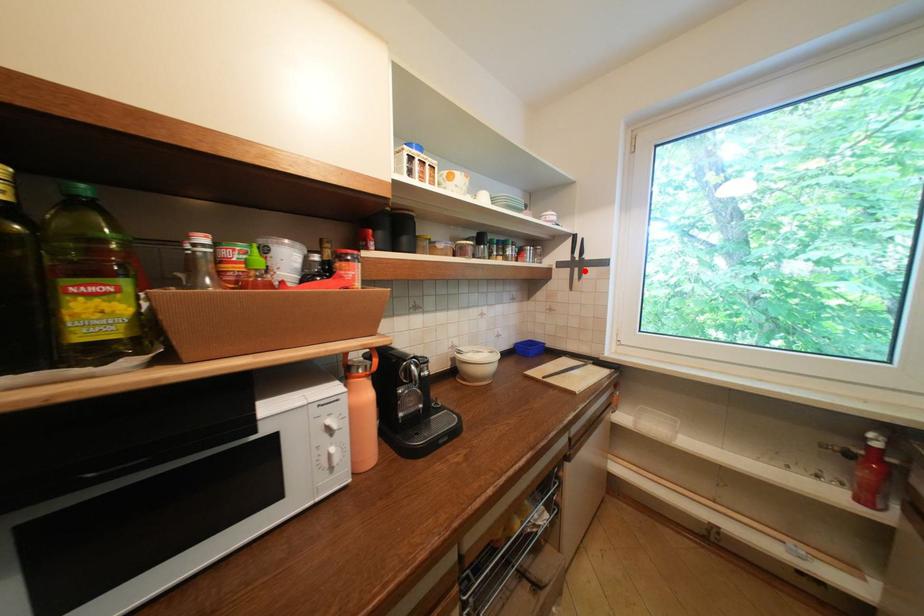
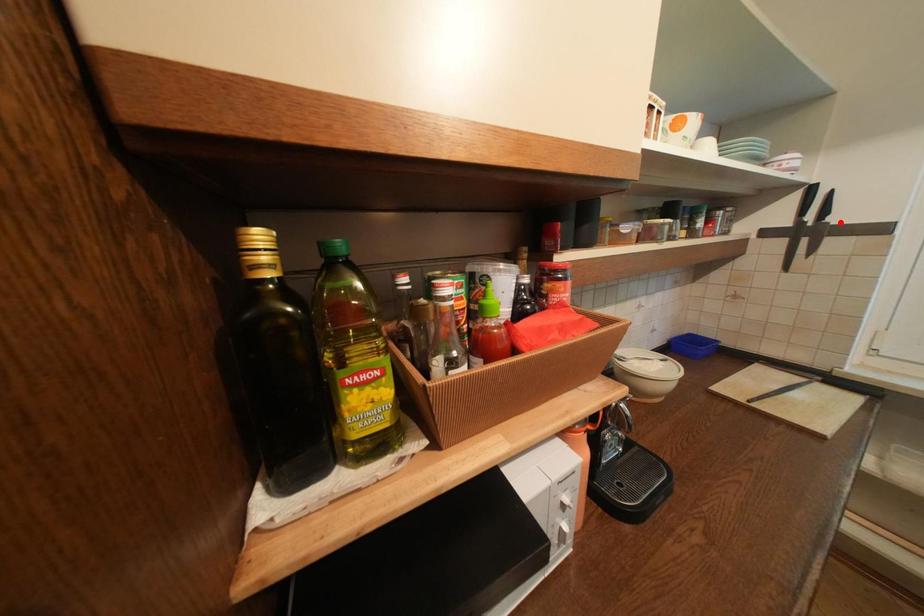
I am providing you with two images of the same scene from different viewpoints. A red point is marked on the first image and another point is marked on the second image. Is the red point in image1 aligned with the point shown in image2?

No